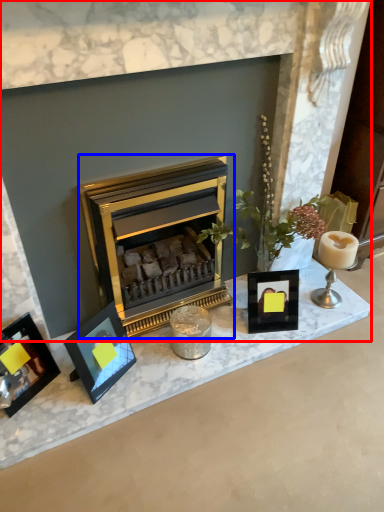
Question: Which of the following is the closest to the observer, fireplace (highlighted by a red box) or wood burning stove (highlighted by a blue box)?

Choices:
 (A) fireplace
 (B) wood burning stove

Answer: (A)